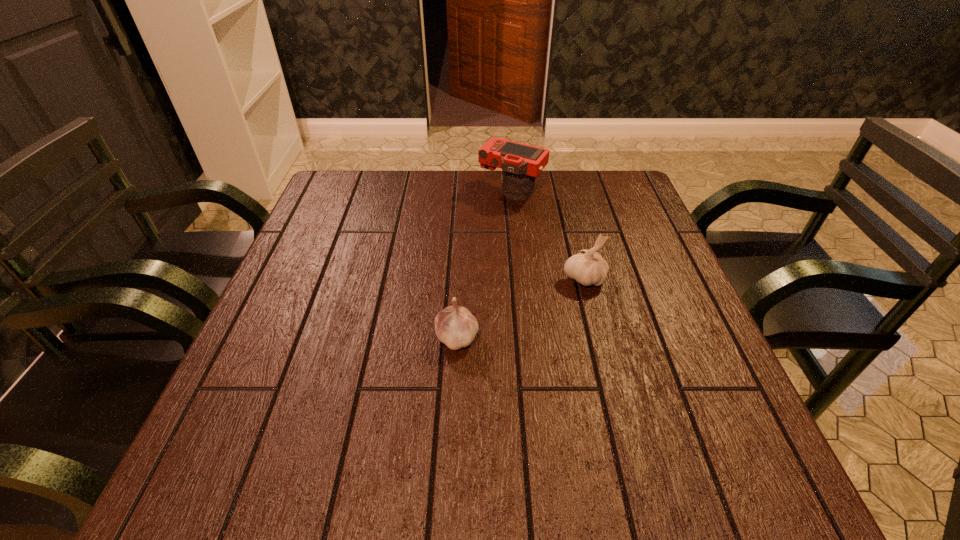
The height and width of the screenshot is (540, 960). Find the location of `camera`. camera is located at coordinates (521, 163).

What are the coordinates of `the second farthest object` in the screenshot? It's located at (587, 267).

Where is `the right garlic`? This screenshot has width=960, height=540. the right garlic is located at coordinates (587, 267).

Where is `the left garlic`? the left garlic is located at coordinates (455, 326).

Locate an element on the screen. This screenshot has width=960, height=540. the nearer garlic is located at coordinates (455, 326).

The height and width of the screenshot is (540, 960). I want to click on vacant space located on the right of the camera, so click(562, 191).

Locate an element on the screen. The height and width of the screenshot is (540, 960). vacant space located 0.250m on the front of the right garlic is located at coordinates (612, 389).

Find the location of a particular element. The image size is (960, 540). blank space located on the left of the nearer garlic is located at coordinates (324, 337).

Locate an element on the screen. object that is at the far edge is located at coordinates click(x=521, y=163).

You are a GUI agent. You are given a task and a screenshot of the screen. Output one action in this format:
    pyautogui.click(x=<x>, y=<y>)
    Task: Click on the vacant space at the far edge of the desktop
    
    Given the screenshot: What is the action you would take?
    pyautogui.click(x=473, y=185)